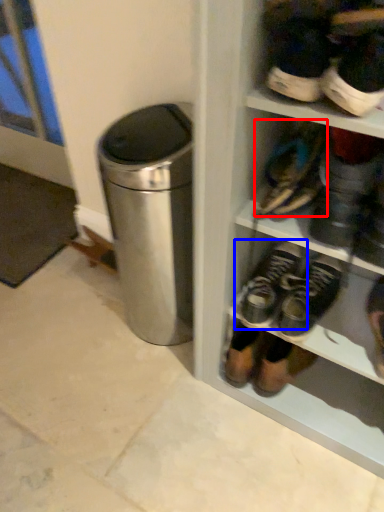
Question: Which of the following is the closest to the observer, footwear (highlighted by a red box) or footwear (highlighted by a blue box)?

Choices:
 (A) footwear
 (B) footwear

Answer: (A)